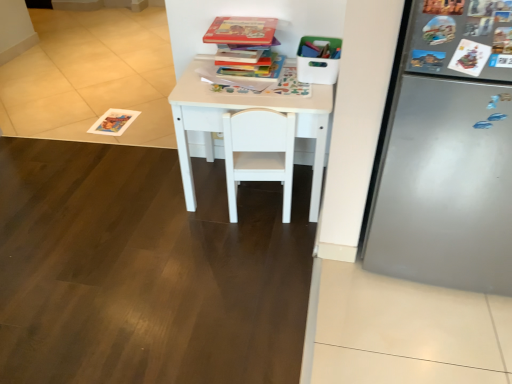
Question: From the image's perspective, would you say white matte table at center is shown under hardcover book at center, marked as the first book in a bottom-to-top arrangement?

Choices:
 (A) yes
 (B) no

Answer: (A)

Question: Is white matte table at center positioned behind hardcover book at center, marked as the first book in a bottom-to-top arrangement?

Choices:
 (A) no
 (B) yes

Answer: (A)

Question: Is white matte table at center taller than hardcover book at center, marked as the third book in a top-to-bottom arrangement?

Choices:
 (A) no
 (B) yes

Answer: (B)

Question: Are white matte table at center and hardcover book at center, marked as the third book in a top-to-bottom arrangement, far apart?

Choices:
 (A) no
 (B) yes

Answer: (A)

Question: Is white matte table at center wider than hardcover book at center, marked as the first book in a bottom-to-top arrangement?

Choices:
 (A) no
 (B) yes

Answer: (B)

Question: From the image's perspective, is white matte table at center on top of hardcover book at center, marked as the third book in a top-to-bottom arrangement?

Choices:
 (A) yes
 (B) no

Answer: (B)

Question: From the image's perspective, is hardcover book at upper center, which appears as the 2th book when ordered from the bottom, located beneath white matte chair at center?

Choices:
 (A) no
 (B) yes

Answer: (A)

Question: Is hardcover book at upper center, the second book viewed from the top, oriented towards white matte chair at center?

Choices:
 (A) no
 (B) yes

Answer: (A)

Question: From a real-world perspective, is hardcover book at upper center, which appears as the 2th book when ordered from the bottom, physically above white matte chair at center?

Choices:
 (A) yes
 (B) no

Answer: (A)

Question: Is hardcover book at upper center, which appears as the 2th book when ordered from the bottom, facing away from white matte chair at center?

Choices:
 (A) yes
 (B) no

Answer: (B)

Question: Considering the relative sizes of hardcover book at upper center, the second book viewed from the top, and white matte chair at center in the image provided, is hardcover book at upper center, the second book viewed from the top, thinner than white matte chair at center?

Choices:
 (A) no
 (B) yes

Answer: (B)

Question: Can you confirm if hardcover book at upper center, which appears as the 2th book when ordered from the bottom, is positioned to the right of white matte chair at center?

Choices:
 (A) yes
 (B) no

Answer: (B)

Question: Does hardcover book at upper center, the 1th book positioned from the top, lie behind hardcover book at upper center, the second book viewed from the top?

Choices:
 (A) yes
 (B) no

Answer: (B)